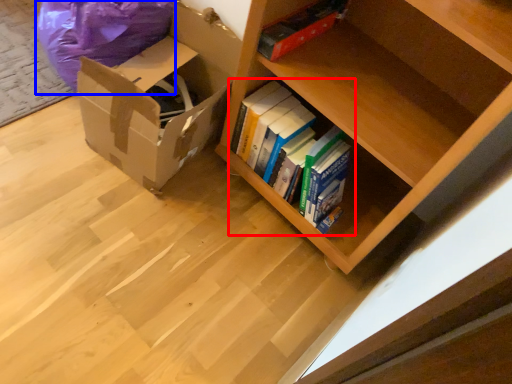
Question: Which point is further to the camera, book (highlighted by a red box) or bean bag chair (highlighted by a blue box)?

Choices:
 (A) book
 (B) bean bag chair

Answer: (A)